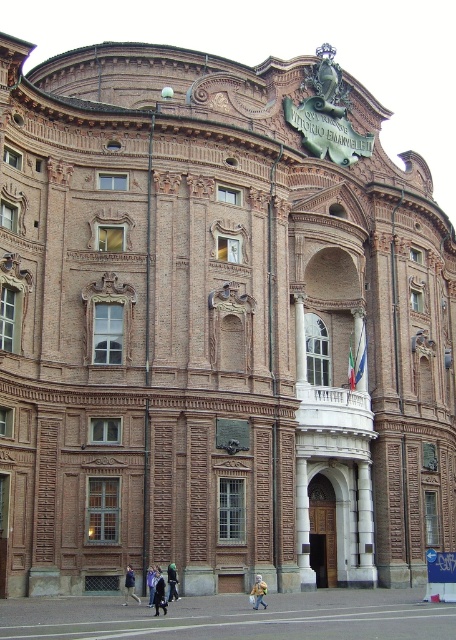
Question: Which object is closer to the camera taking this photo?

Choices:
 (A) yellow plastic bag at center
 (B) dark blue jeans at lower center
 (C) dark blue fabric jacket at lower center

Answer: (C)

Question: Considering the relative positions of dark blue fabric jacket at lower center and dark blue jacket at lower center in the image provided, where is dark blue fabric jacket at lower center located with respect to dark blue jacket at lower center?

Choices:
 (A) left
 (B) right

Answer: (B)

Question: Is yellow plastic bag at center positioned behind dark blue jacket at lower center?

Choices:
 (A) no
 (B) yes

Answer: (A)

Question: Is dark blue fabric jacket at lower center below dark blue jacket at lower center?

Choices:
 (A) no
 (B) yes

Answer: (A)

Question: Based on their relative distances, which object is farther from the yellow plastic bag at center?

Choices:
 (A) dark blue jeans at lower center
 (B) dark blue jacket at lower center
 (C) light blue denim jacket at lower center

Answer: (B)

Question: Among these points, which one is farthest from the camera?

Choices:
 (A) (259, 584)
 (B) (146, 576)

Answer: (B)